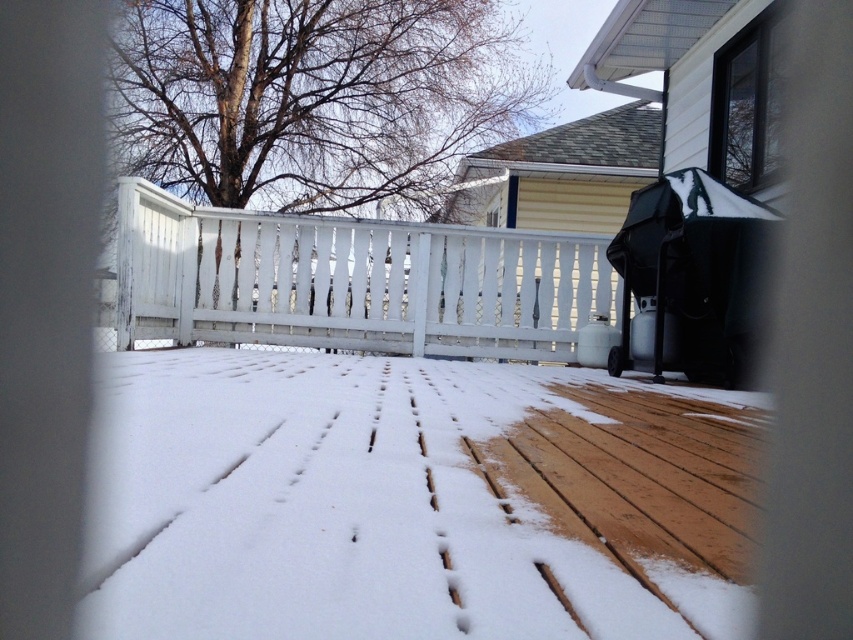
Between white wood deck at center and white painted wood porch at center, which one is positioned lower?

white wood deck at center is below.

Does point (235, 451) come behind point (271, 292)?

That is False.

Locate an element on the screen. This screenshot has height=640, width=853. white wood deck at center is located at coordinates (410, 500).